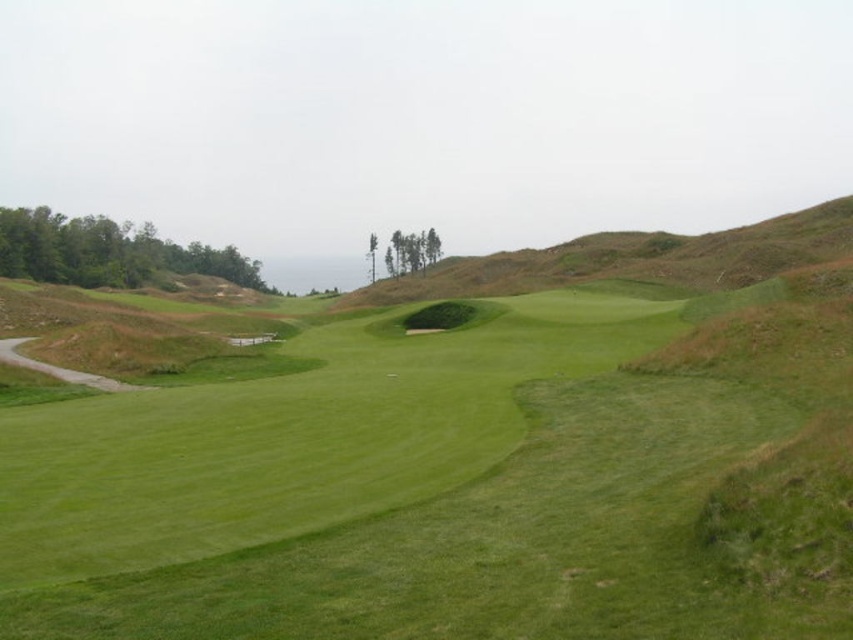
You are a golfer standing on the green grassy golf course at center. You want to hit the ball to the brown earthy hillside at center. Based on the scene, which direction should you aim your shot?

The green grassy golf course at center is below the brown earthy hillside at center, so you should aim upwards towards the brown earthy hillside at center.

You are a golfer trying to hit your ball from the green grassy golf course at center to the brown earthy hillside at center. Which object is shorter in height?

The green grassy golf course at center is not as tall as the brown earthy hillside at center, so the green grassy golf course at center is shorter in height.

You are a golfer standing on the green grassy golf course at center. You want to hit the ball towards the brown earthy hillside at center. Which direction should you aim your shot to ensure the ball travels towards the hillside?

Since the green grassy golf course at center is in front of the brown earthy hillside at center, you should aim directly towards the hillside as it is positioned behind the golf course in the scene.